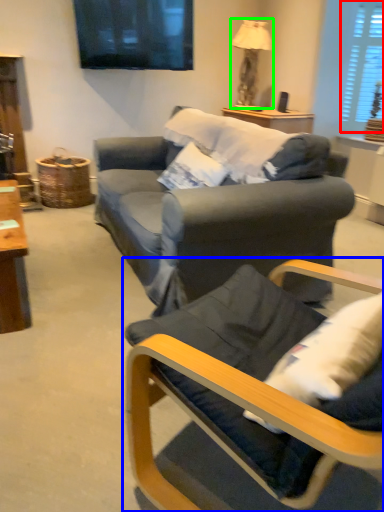
Question: Estimate the real-world distances between objects in this image. Which object is farther from window (highlighted by a red box), chair (highlighted by a blue box) or lamp (highlighted by a green box)?

Choices:
 (A) chair
 (B) lamp

Answer: (A)